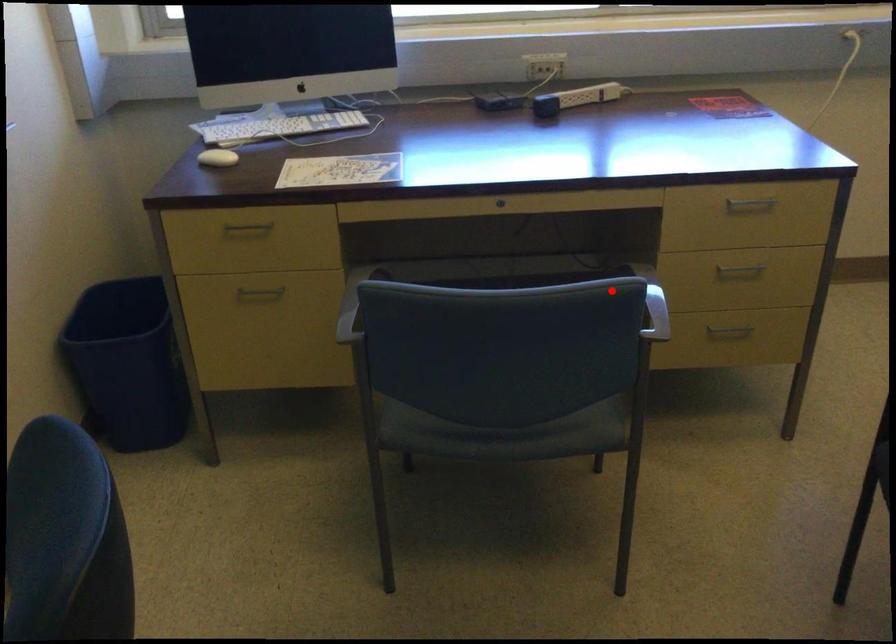
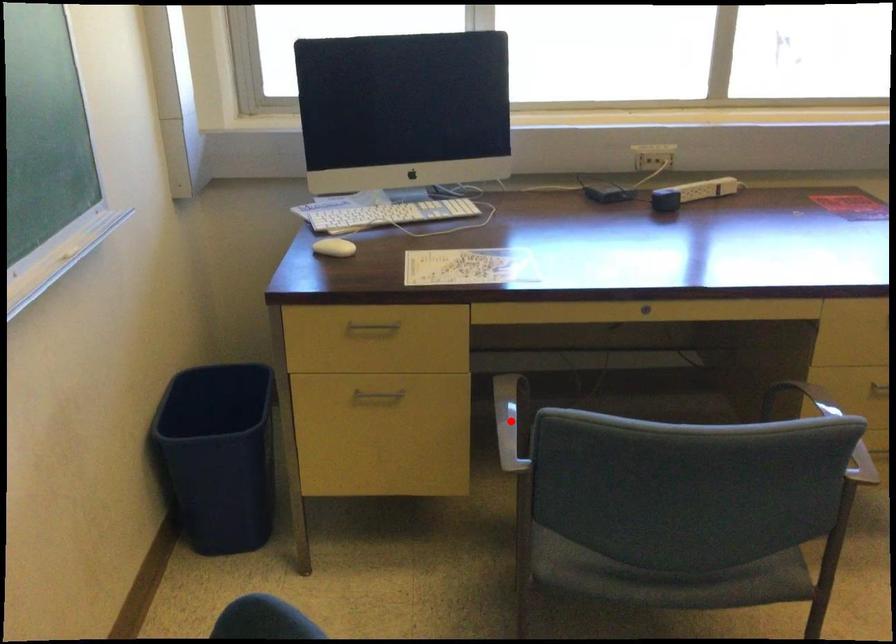
I am providing you with two images of the same scene from different viewpoints. A red point is marked on the first image and another point is marked on the second image. Is the red point in image1 aligned with the point shown in image2?

No